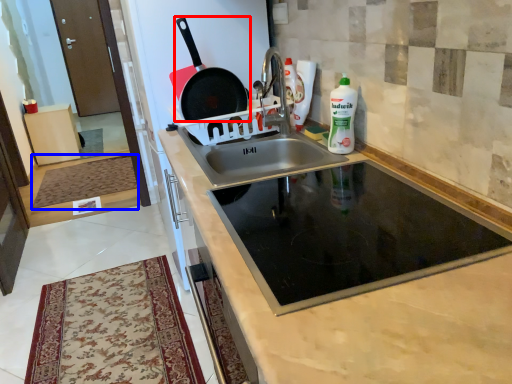
Question: Which object appears farthest to the camera in this image, frying pan (highlighted by a red box) or mat (highlighted by a blue box)?

Choices:
 (A) frying pan
 (B) mat

Answer: (B)